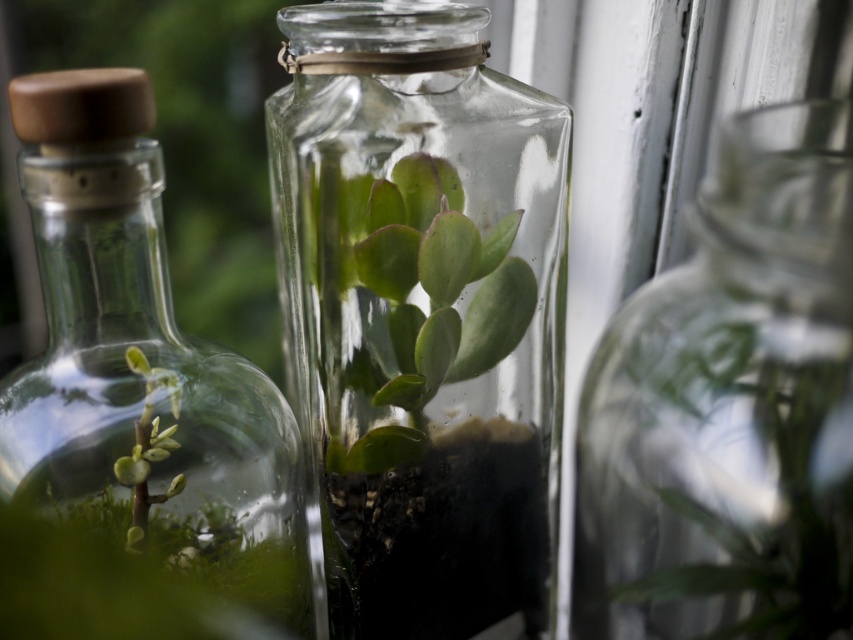
You are a delivery person who needs to place a third bottle between the transparent glass vase at center and the clear glass bottle at left. The new bottle must fit snugly without touching either. Is there enough space for it?

The transparent glass vase at center and the clear glass bottle at left are 1.79 inches apart from each other. Since the new bottle needs to fit snugly without touching either, the space must be at least the width of the new bottle. However, without knowing the exact width of the new bottle, it is impossible to determine if there is enough space. Please provide the width of the new bottle to proceed.

Looking at this image, you are a delivery robot navigating through a display of terrariums. You need to move from the starting point at point (146, 141) to the delivery point at point (796, 252). Is the path between these two points clear of any obstacles?

The path between point (796, 252) and point (146, 141) is clear because point (796, 252) is in front of point (146, 141), meaning there are no objects blocking the path between them.